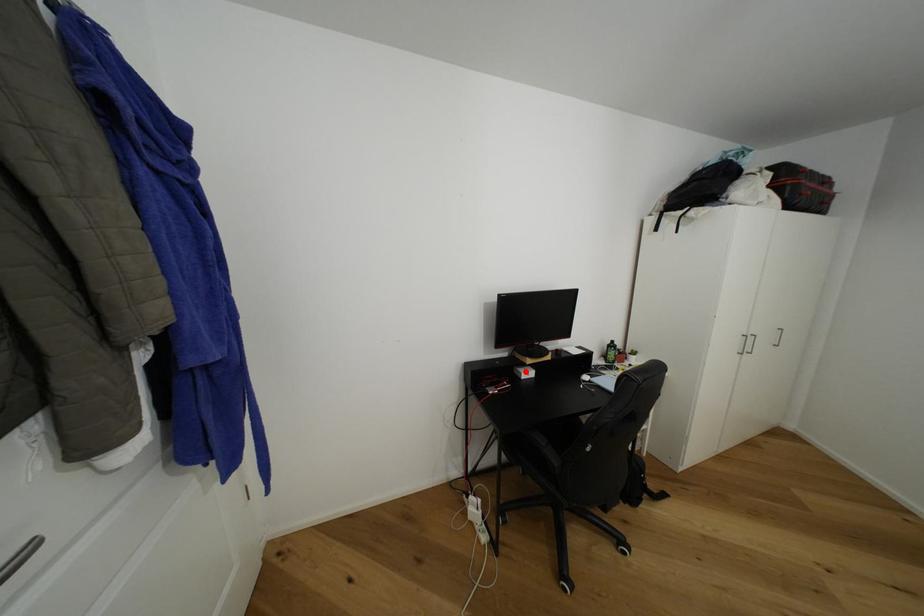
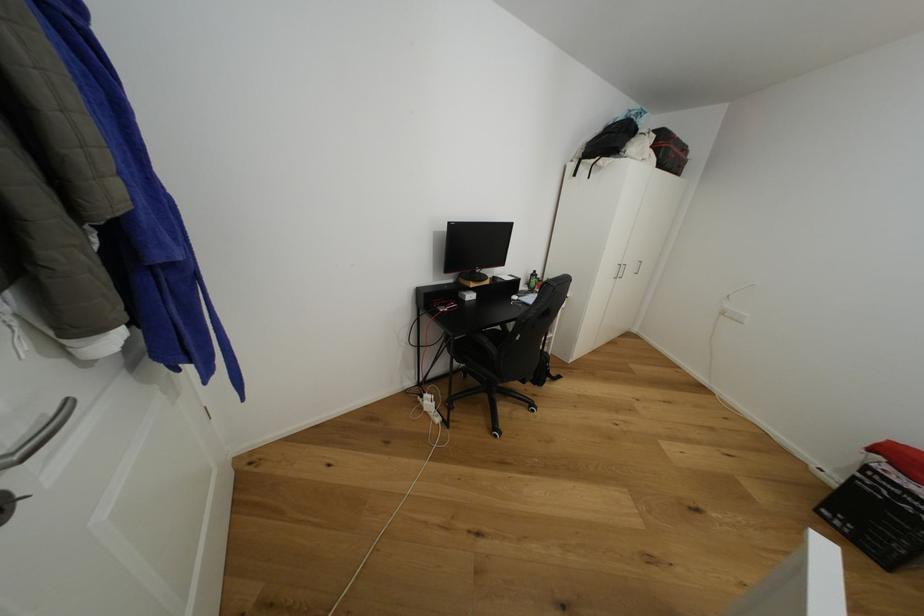
The point at the highlighted location is marked in the first image. Where is the corresponding point in the second image?

(469, 294)